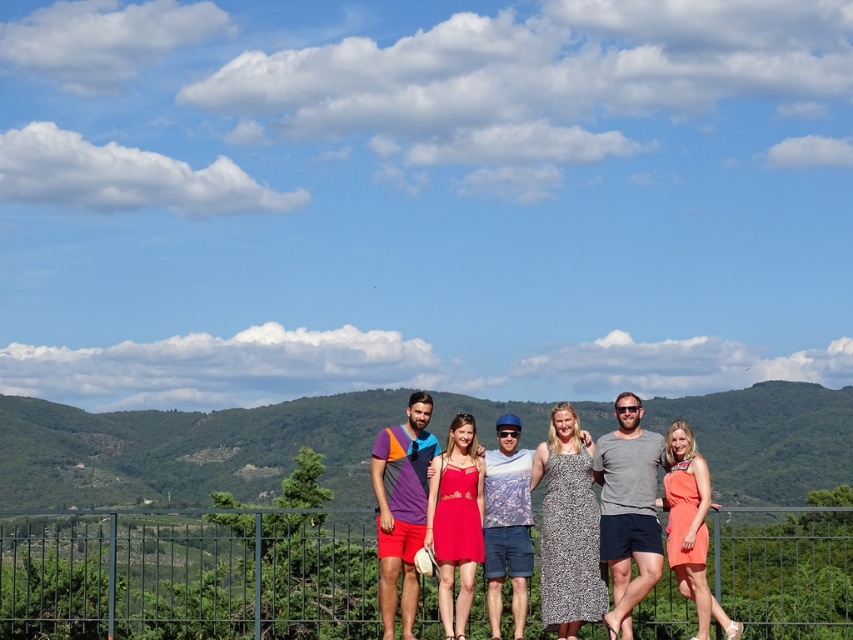
Does gray cotton t-shirt at center have a greater width compared to blue denim shorts at center?

Indeed, gray cotton t-shirt at center has a greater width compared to blue denim shorts at center.

Looking at this image, does gray cotton t-shirt at center have a lesser height compared to blue denim shorts at center?

No, gray cotton t-shirt at center is not shorter than blue denim shorts at center.

Who is more distant from viewer, (614,435) or (509,456)?

Point (509,456)

Locate an element on the screen. This screenshot has height=640, width=853. gray cotton t-shirt at center is located at coordinates (628, 509).

Can you confirm if gray cotton t-shirt at center is wider than orange satin dress at right?

Correct, the width of gray cotton t-shirt at center exceeds that of orange satin dress at right.

Which is in front, point (643, 545) or point (698, 557)?

Point (698, 557) is more forward.

Locate an element on the screen. The height and width of the screenshot is (640, 853). gray cotton t-shirt at center is located at coordinates (628, 509).

Can you confirm if green metal fence at lower center is positioned above orange satin dress at right?

No.

Is green metal fence at lower center thinner than orange satin dress at right?

No.

What do you see at coordinates (187, 573) in the screenshot? The width and height of the screenshot is (853, 640). I see `green metal fence at lower center` at bounding box center [187, 573].

I want to click on green metal fence at lower center, so click(x=187, y=573).